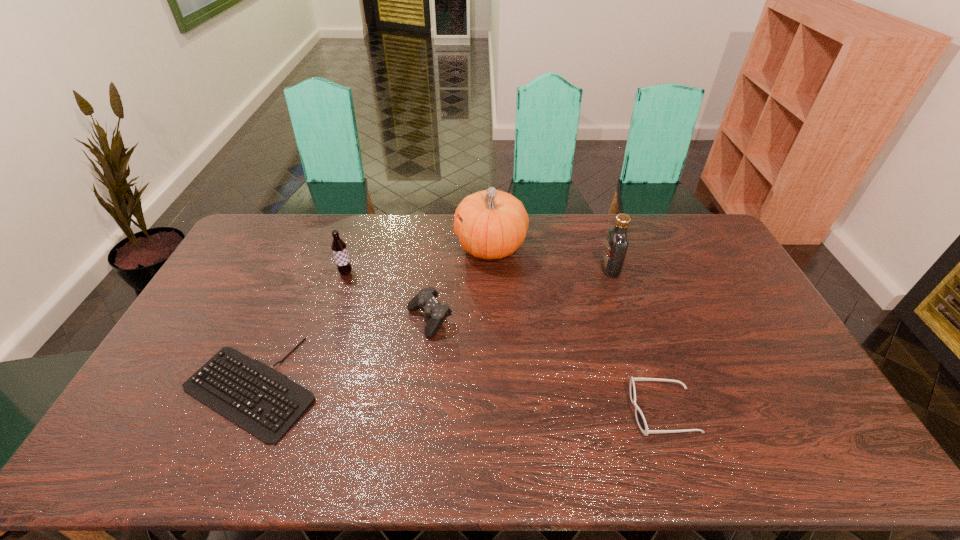
The height and width of the screenshot is (540, 960). I want to click on computer keyboard that is at the near edge, so click(264, 402).

You are a GUI agent. You are given a task and a screenshot of the screen. Output one action in this format:
    pyautogui.click(x=<x>, y=<y>)
    Task: Click on the object that is at the left edge
    The width and height of the screenshot is (960, 540).
    Given the screenshot: What is the action you would take?
    pyautogui.click(x=264, y=402)

Where is `object at the near left corner`? The image size is (960, 540). object at the near left corner is located at coordinates (264, 402).

The width and height of the screenshot is (960, 540). In the image, there is a desktop. In order to click on vacant space at the far edge in this screenshot , I will do `click(377, 243)`.

At what (x,y) coordinates should I click in order to perform the action: click on vacant area at the near edge of the desktop. Please return your answer as a coordinate pair (x, y). Image resolution: width=960 pixels, height=540 pixels. Looking at the image, I should click on (449, 460).

This screenshot has width=960, height=540. In the image, there is a desktop. What are the coordinates of `blank space at the left edge` in the screenshot? It's located at (141, 424).

In the image, there is a desktop. Where is `free space at the right edge`? This screenshot has height=540, width=960. free space at the right edge is located at coordinates (796, 408).

The height and width of the screenshot is (540, 960). I want to click on vacant space at the far right corner, so click(702, 227).

At what (x,y) coordinates should I click in order to perform the action: click on vacant area that lies between the root beer and the vodka. Please return your answer as a coordinate pair (x, y). This screenshot has height=540, width=960. Looking at the image, I should click on 478,271.

What are the coordinates of `free space between the sunglasses and the pumpkin` in the screenshot? It's located at (577, 329).